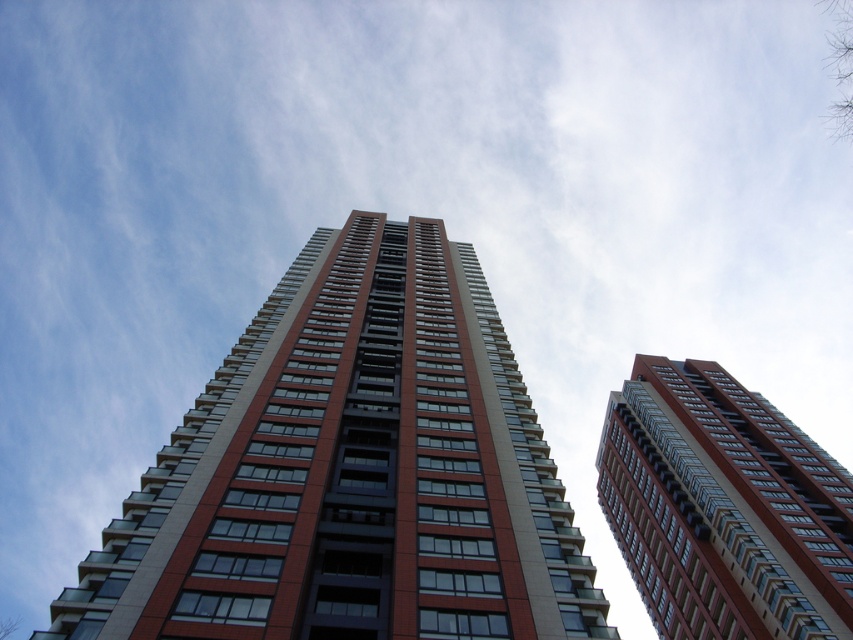
This screenshot has height=640, width=853. What are the coordinates of `red brick building at center` in the screenshot? It's located at (351, 472).

Is point (189, 563) positioned after point (782, 435)?

No, it is in front of (782, 435).

Identify the location of red brick building at center. The height and width of the screenshot is (640, 853). (351, 472).